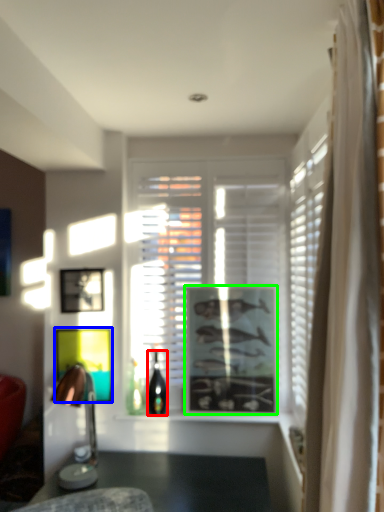
Question: Which object is the closest to the bottle (highlighted by a red box)? Choose among these: picture frame (highlighted by a blue box) or picture frame (highlighted by a green box).

Choices:
 (A) picture frame
 (B) picture frame

Answer: (A)